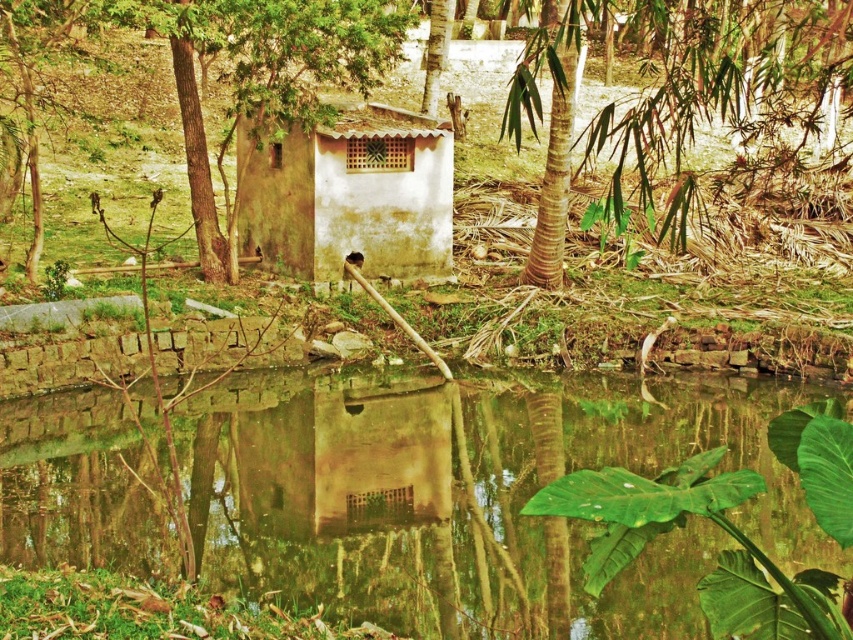
Between clear water at center and brown textured tree at center, which one is positioned lower?

Positioned lower is clear water at center.

Which is in front, point (242, 586) or point (538, 256)?

Point (242, 586)

This screenshot has height=640, width=853. Find the location of `clear water at center`. clear water at center is located at coordinates (474, 497).

Can you confirm if brown textured bamboo at upper right is taller than matte white hut at center?

Correct, brown textured bamboo at upper right is much taller as matte white hut at center.

Who is more forward, (544, 284) or (416, 205)?

Point (416, 205) is more forward.

Who is more forward, (x=660, y=228) or (x=323, y=227)?

Point (x=660, y=228) is in front.

Where is `brown textured bamboo at upper right`? The height and width of the screenshot is (640, 853). brown textured bamboo at upper right is located at coordinates (672, 96).

The image size is (853, 640). I want to click on matte white hut at center, so click(x=350, y=195).

Who is taller, matte white hut at center or brown textured tree at center?

brown textured tree at center is taller.

Who is more distant from viewer, (308, 259) or (566, 88)?

The point (308, 259) is more distant.

The image size is (853, 640). In order to click on matte white hut at center in this screenshot , I will do `click(350, 195)`.